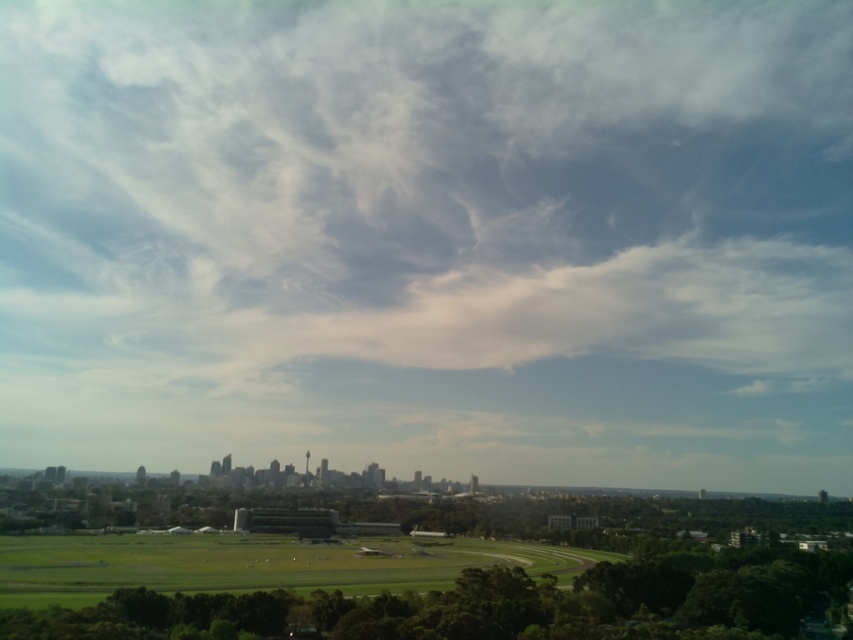
Question: Does white cotton cloud at upper center have a lesser width compared to green grassy field at lower center?

Choices:
 (A) yes
 (B) no

Answer: (B)

Question: Which of the following is the farthest from the observer?

Choices:
 (A) green grassy field at lower center
 (B) white cotton cloud at upper center

Answer: (B)

Question: Does white cotton cloud at upper center appear on the left side of green grassy field at lower center?

Choices:
 (A) no
 (B) yes

Answer: (A)

Question: Can you confirm if white cotton cloud at upper center is positioned above green grassy field at lower center?

Choices:
 (A) no
 (B) yes

Answer: (B)